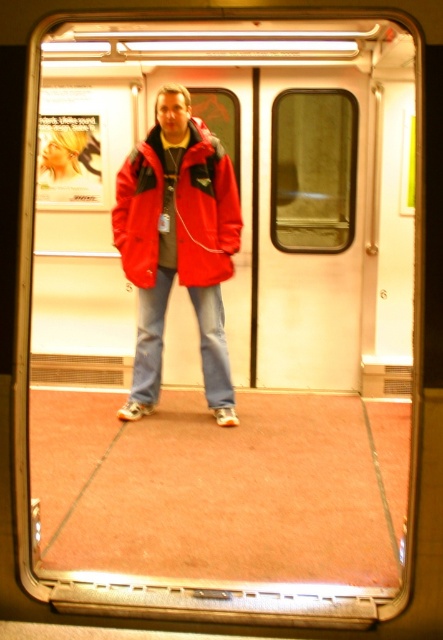
Question: Which object is farther from the camera taking this photo?

Choices:
 (A) matte nylon jacket at center
 (B) white matte door at center

Answer: (B)

Question: Is the position of white matte door at center more distant than that of matte nylon jacket at center?

Choices:
 (A) yes
 (B) no

Answer: (A)

Question: Is white matte door at center above matte nylon jacket at center?

Choices:
 (A) yes
 (B) no

Answer: (B)

Question: Which point appears farthest from the camera in this image?

Choices:
 (A) (272, 84)
 (B) (136, 232)

Answer: (A)

Question: Is white matte door at center smaller than matte nylon jacket at center?

Choices:
 (A) no
 (B) yes

Answer: (A)